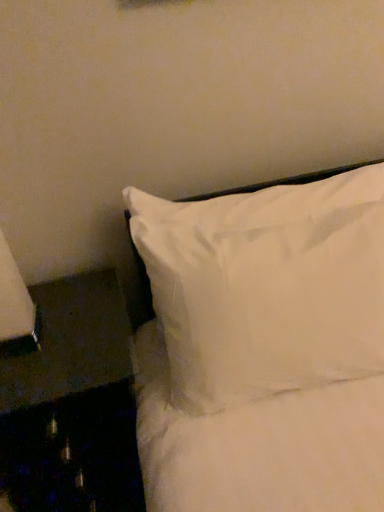
This screenshot has height=512, width=384. What are the coordinates of `free point above black fabric side table at lower left (from a real-world perspective)` in the screenshot? It's located at (49, 340).